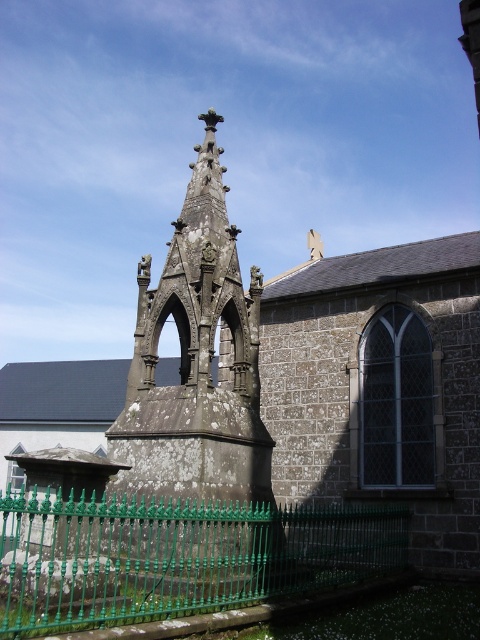
You are standing in front of the Gothic monument and want to place two markers at specific coordinates. The first marker is at point (147, 454) and the second at point (197, 518). From your perspective, which marker is closer to the monument?

Point (197, 518) is closer to the monument because point (147, 454) is behind it according to the coordinates provided.

From the picture: You are standing in front of the monument and want to take a photo of the rough stone tower at center and the green wrought iron fence at lower center. To ensure both are in frame, should you position yourself to the left or right of the fence?

You should position yourself to the left of the green wrought iron fence at lower center because the rough stone tower at center is to the right of the green wrought iron fence at lower center, so standing left will allow both to be captured in the photo.

You are standing at the center of the churchyard and want to find the rough stone tower at center. Which direction should you look to see it?

The rough stone tower at center is located at point 0.619 on the x axis and 0.415 on the y axis, so you should look towards the center of the churchyard to see it.